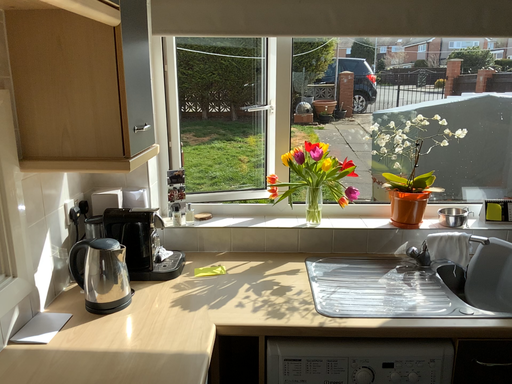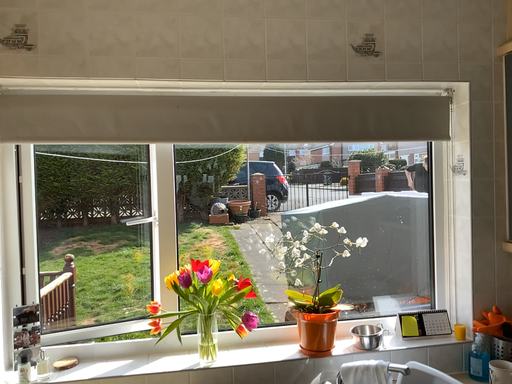
Question: How did the camera likely rotate when shooting the video?

Choices:
 (A) rotated upward
 (B) rotated downward

Answer: (A)